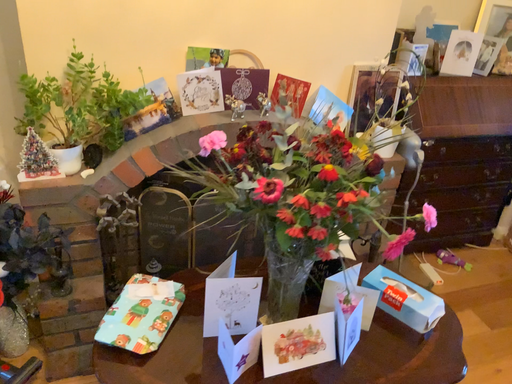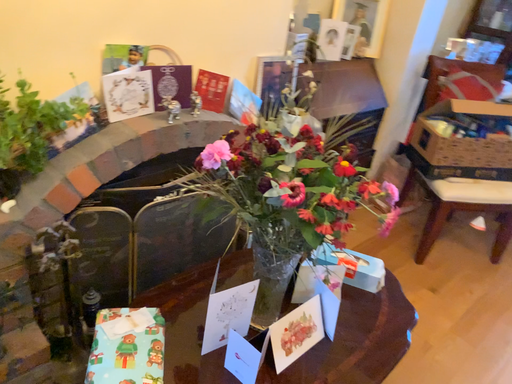
Question: How did the camera likely rotate when shooting the video?

Choices:
 (A) rotated left
 (B) rotated right

Answer: (B)